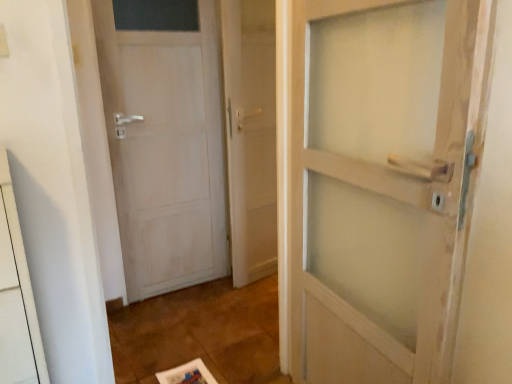
At what (x,y) coordinates should I click in order to perform the action: click on clear glass door at center. Please return your answer as a coordinate pair (x, y). Looking at the image, I should click on (250, 135).

What do you see at coordinates (250, 135) in the screenshot?
I see `clear glass door at center` at bounding box center [250, 135].

This screenshot has height=384, width=512. Describe the element at coordinates (164, 141) in the screenshot. I see `white matte door at left` at that location.

This screenshot has height=384, width=512. I want to click on white matte door at left, so click(164, 141).

You are a GUI agent. You are given a task and a screenshot of the screen. Output one action in this format:
    pyautogui.click(x=<x>, y=<y>)
    Task: Click on the clear glass door at center
    The height and width of the screenshot is (384, 512).
    Given the screenshot: What is the action you would take?
    pyautogui.click(x=250, y=135)

Looking at this image, is white matte door at left to the right of clear glass door at center from the viewer's perspective?

Incorrect, white matte door at left is not on the right side of clear glass door at center.

Looking at this image, which object is closer to the camera, white matte door at left or clear glass door at center?

white matte door at left.

Between point (102, 70) and point (261, 213), which one is positioned behind?

The point (261, 213) is behind.

From the image's perspective, is white matte door at left above clear glass door at center?

No, from the image's perspective, white matte door at left is not on top of clear glass door at center.

From a real-world perspective, is white matte door at left above or below clear glass door at center?

Clearly, from a real-world perspective, white matte door at left is below clear glass door at center.

Which object is thinner, white matte door at left or clear glass door at center?

Thinner between the two is white matte door at left.

From their relative heights in the image, would you say white matte door at left is taller or shorter than clear glass door at center?

Considering their sizes, white matte door at left has less height than clear glass door at center.

Based on the photo, is white matte door at left bigger than clear glass door at center?

Indeed, white matte door at left has a larger size compared to clear glass door at center.

Is white matte door at left spatially inside clear glass door at center, or outside of it?

white matte door at left is outside clear glass door at center.

Based on the photo, would you consider white matte door at left to be distant from clear glass door at center?

No, white matte door at left is not far from clear glass door at center.

In the scene shown: Is white matte door at left aimed at clear glass door at center?

No, white matte door at left is not turned towards clear glass door at center.

How different are the orientations of white matte door at left and clear glass door at center in degrees?

The facing directions of white matte door at left and clear glass door at center are 8.79 degrees apart.

Find the location of a particular element. door beneath the clear glass door at center (from a real-world perspective) is located at coordinates (164, 141).

Can you confirm if clear glass door at center is positioned to the right of white matte door at left?

Indeed, clear glass door at center is positioned on the right side of white matte door at left.

Is clear glass door at center behind white matte door at left?

Yes, clear glass door at center is behind white matte door at left.

Does point (257, 184) come behind point (162, 228)?

That is True.

From the image's perspective, which is below, clear glass door at center or white matte door at left?

white matte door at left is shown below in the image.

From a real-world perspective, between clear glass door at center and white matte door at left, who is vertically lower?

white matte door at left, from a real-world perspective.

Considering the relative sizes of clear glass door at center and white matte door at left in the image provided, is clear glass door at center wider than white matte door at left?

Yes.

Considering the sizes of objects clear glass door at center and white matte door at left in the image provided, who is taller, clear glass door at center or white matte door at left?

clear glass door at center.

Which of these two, clear glass door at center or white matte door at left, is smaller?

With smaller size is clear glass door at center.

Would you say white matte door at left is part of clear glass door at center's contents?

No, white matte door at left is not a part of clear glass door at center.

Are clear glass door at center and white matte door at left far apart?

They are positioned close to each other.

Is clear glass door at center turned away from white matte door at left?

That's not correct — clear glass door at center is not looking away from white matte door at left.

Locate an element on the screen. The image size is (512, 384). screen door located on the right of white matte door at left is located at coordinates (250, 135).

Identify the location of door that is under the clear glass door at center (from a real-world perspective). (164, 141).

Locate an element on the screen. Image resolution: width=512 pixels, height=384 pixels. door on the left of clear glass door at center is located at coordinates (164, 141).